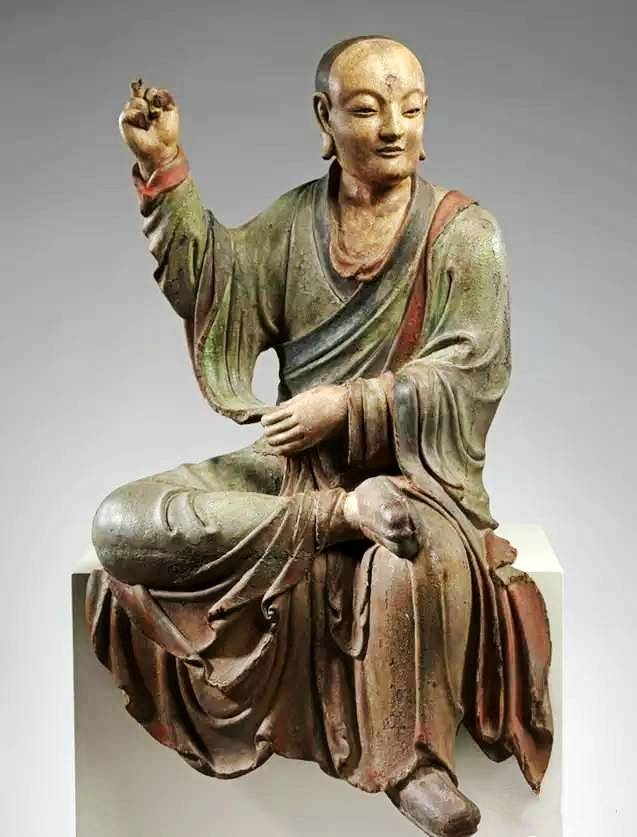
Find the location of a particular element. The width and height of the screenshot is (637, 837). pedestal is located at coordinates (294, 805).